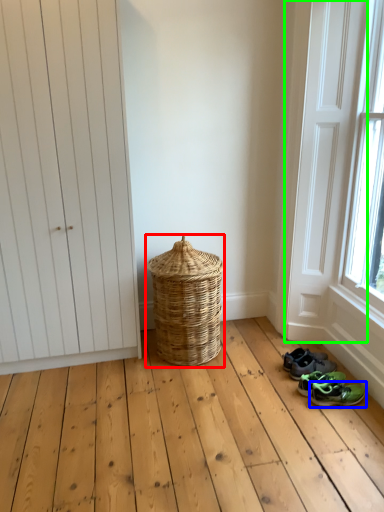
Question: Considering the real-world distances, which object is closest to basket (highlighted by a red box)? footwear (highlighted by a blue box) or screen door (highlighted by a green box).

Choices:
 (A) footwear
 (B) screen door

Answer: (B)